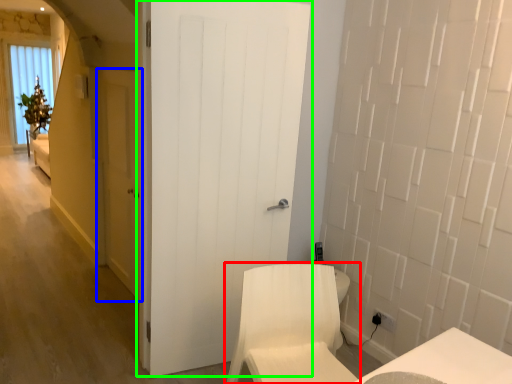
Question: Based on their relative distances, which object is farther from furniture (highlighted by a red box)? Choose from door (highlighted by a blue box) and door (highlighted by a green box).

Choices:
 (A) door
 (B) door

Answer: (A)